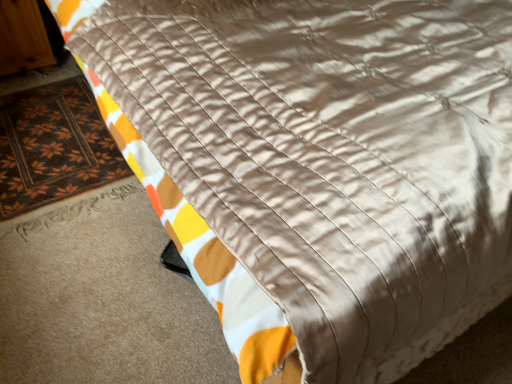
Find the location of a particular element. The image size is (512, 384). brown woven mat at lower left is located at coordinates (53, 147).

What is the approximate width of brown woven mat at lower left?

brown woven mat at lower left is 38.05 inches wide.

The image size is (512, 384). Describe the element at coordinates (53, 147) in the screenshot. I see `brown woven mat at lower left` at that location.

Where is `wooden armoire at upper left`? Image resolution: width=512 pixels, height=384 pixels. wooden armoire at upper left is located at coordinates pos(23,37).

The image size is (512, 384). What do you see at coordinates (23, 37) in the screenshot? I see `wooden armoire at upper left` at bounding box center [23, 37].

Image resolution: width=512 pixels, height=384 pixels. What are the coordinates of `brown woven mat at lower left` in the screenshot? It's located at (53, 147).

Which is more to the right, brown woven mat at lower left or wooden armoire at upper left?

From the viewer's perspective, brown woven mat at lower left appears more on the right side.

Between brown woven mat at lower left and wooden armoire at upper left, which one is positioned in front?

Positioned in front is brown woven mat at lower left.

Which point is more distant from viewer, (91, 124) or (8, 40)?

The point (8, 40) is more distant.

From the image's perspective, between brown woven mat at lower left and wooden armoire at upper left, who is located below?

brown woven mat at lower left appears lower in the image.

From a real-world perspective, is brown woven mat at lower left over wooden armoire at upper left?

Incorrect, from a real-world perspective, brown woven mat at lower left is lower than wooden armoire at upper left.

Is brown woven mat at lower left wider than wooden armoire at upper left?

Indeed, brown woven mat at lower left has a greater width compared to wooden armoire at upper left.

Considering the sizes of objects brown woven mat at lower left and wooden armoire at upper left in the image provided, who is taller, brown woven mat at lower left or wooden armoire at upper left?

wooden armoire at upper left.

Considering the sizes of objects brown woven mat at lower left and wooden armoire at upper left in the image provided, who is bigger, brown woven mat at lower left or wooden armoire at upper left?

wooden armoire at upper left.

Would you say brown woven mat at lower left is outside wooden armoire at upper left?

Indeed, brown woven mat at lower left is completely outside wooden armoire at upper left.

Are brown woven mat at lower left and wooden armoire at upper left making contact?

brown woven mat at lower left and wooden armoire at upper left are not in contact.

Is brown woven mat at lower left aimed at wooden armoire at upper left?

No, brown woven mat at lower left is not turned towards wooden armoire at upper left.

How many degrees apart are the facing directions of brown woven mat at lower left and wooden armoire at upper left?

The angular difference between brown woven mat at lower left and wooden armoire at upper left is 0.891 degrees.

Find the location of a particular element. The width and height of the screenshot is (512, 384). armoire that is above the brown woven mat at lower left (from a real-world perspective) is located at coordinates (23, 37).

Considering the relative positions of wooden armoire at upper left and brown woven mat at lower left in the image provided, is wooden armoire at upper left to the left of brown woven mat at lower left from the viewer's perspective?

Correct, you'll find wooden armoire at upper left to the left of brown woven mat at lower left.

Is wooden armoire at upper left positioned behind brown woven mat at lower left?

Yes, it is behind brown woven mat at lower left.

Consider the image. Which point is more distant from viewer, (15, 1) or (106, 175)?

The point (15, 1) is behind.

Based on the photo, from the image's perspective, is wooden armoire at upper left below brown woven mat at lower left?

No.

From a real-world perspective, is wooden armoire at upper left positioned under brown woven mat at lower left based on gravity?

No.

Looking at their sizes, would you say wooden armoire at upper left is wider or thinner than brown woven mat at lower left?

wooden armoire at upper left is thinner than brown woven mat at lower left.

From their relative heights in the image, would you say wooden armoire at upper left is taller or shorter than brown woven mat at lower left?

Considering their sizes, wooden armoire at upper left has more height than brown woven mat at lower left.

Can you confirm if wooden armoire at upper left is smaller than brown woven mat at lower left?

Actually, wooden armoire at upper left might be larger than brown woven mat at lower left.

Is wooden armoire at upper left situated inside brown woven mat at lower left or outside?

wooden armoire at upper left lies outside brown woven mat at lower left.

Is wooden armoire at upper left touching brown woven mat at lower left?

wooden armoire at upper left and brown woven mat at lower left are not in contact.

Does wooden armoire at upper left turn towards brown woven mat at lower left?

Yes, wooden armoire at upper left is oriented towards brown woven mat at lower left.

How different are the orientations of wooden armoire at upper left and brown woven mat at lower left in degrees?

0.891 degrees separate the facing orientations of wooden armoire at upper left and brown woven mat at lower left.

Locate an element on the screen. This screenshot has width=512, height=384. armoire above the brown woven mat at lower left (from a real-world perspective) is located at coordinates (23, 37).

Identify the location of mat on the right of the wooden armoire at upper left. The height and width of the screenshot is (384, 512). (53, 147).

Locate an element on the screen. mat in front of the wooden armoire at upper left is located at coordinates pos(53,147).